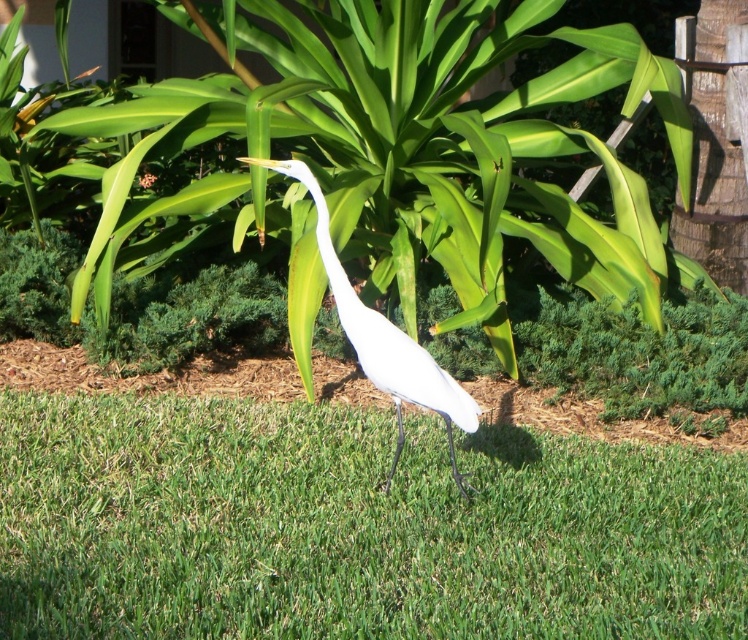
You are a photographer aiming to capture the white matte bird at center and the green grass at center in your shot. Based on their positions, which object should you focus on first if you want to ensure both are in the frame without moving the camera?

The green grass at center is to the left of the white matte bird at center, so you should focus on the white matte bird at center first since it is closer to the center of the frame, ensuring both are within the shot.

You are a photographer trying to capture the white heron in the image. You want to place a marker at point (470,532) and another at point (465,483). Which marker will appear closer to the heron in the photo?

Point (470,532) is closer to the viewer than point (465,483), so the marker at point (470,532) will appear closer to the heron in the photo.